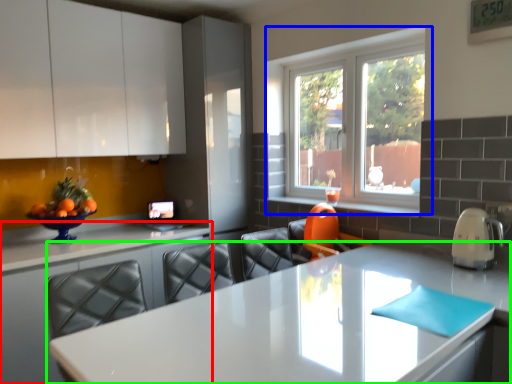
Question: Estimate the real-world distances between objects in this image. Which object is farther from countertop (highlighted by a red box), window (highlighted by a blue box) or countertop (highlighted by a green box)?

Choices:
 (A) window
 (B) countertop

Answer: (A)